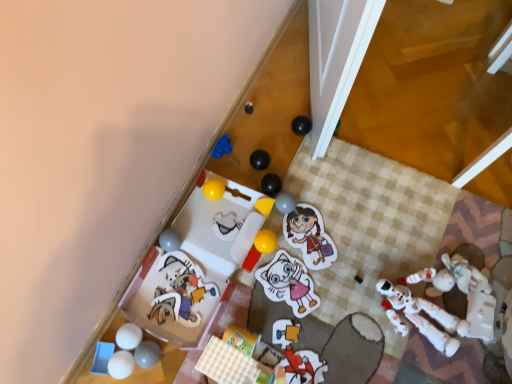
Identify the location of vacant space that's between white rubber ball at lower left, which appears as the second toy when viewed from the left, and rubber matte ball at center, marked as the third toy in a right-to-left arrangement. (213, 277).